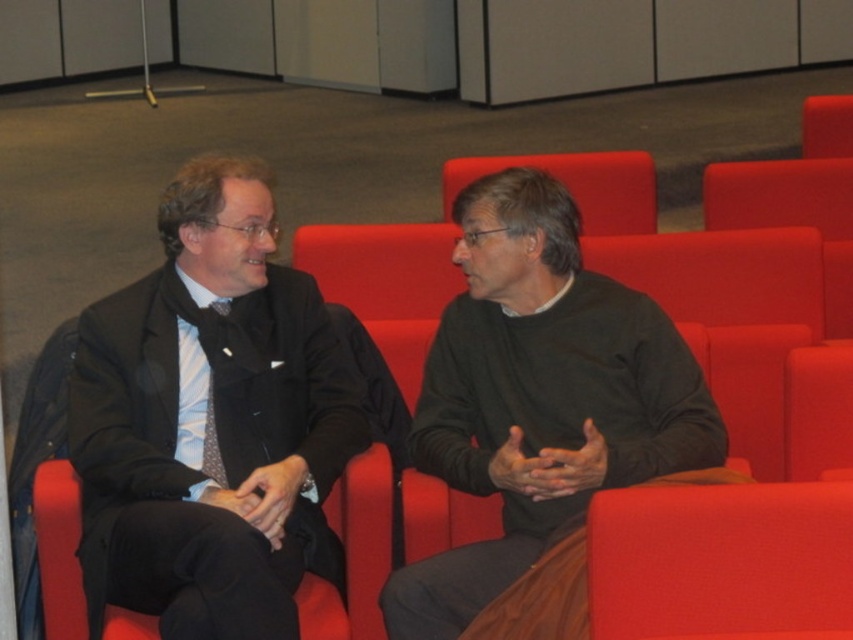
Is point (224, 160) farther from viewer compared to point (450, 417)?

That is False.

Does matte black suit at center have a larger size compared to dark green sweater at center?

Indeed, matte black suit at center has a larger size compared to dark green sweater at center.

Who is more forward, (167,525) or (672,385)?

Point (167,525) is in front.

Identify the location of matte black suit at center. This screenshot has height=640, width=853. (212, 422).